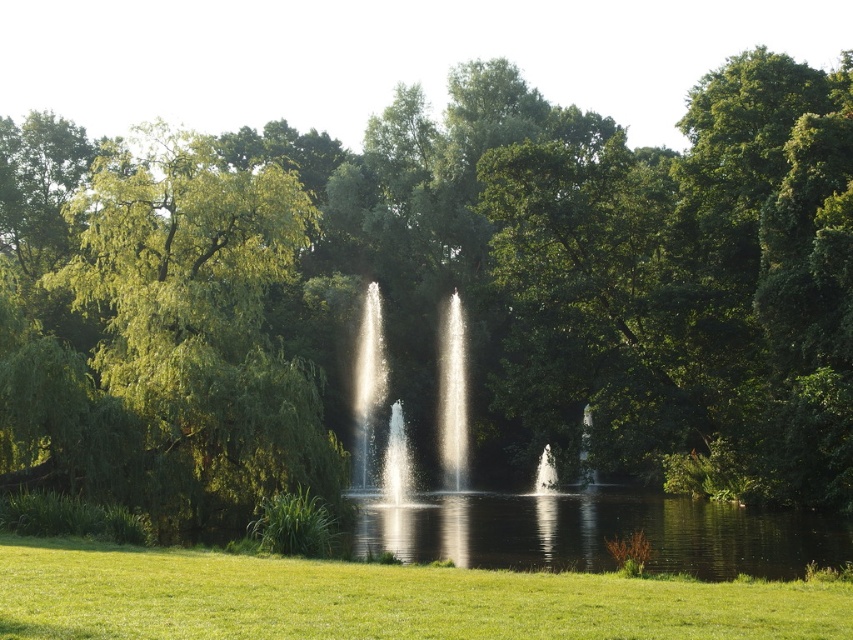
From the picture: You are standing in the park and want to take a photo of the green leafy tree at left and the green grass at lower center. Which object will appear closer to you in the photo?

The green leafy tree at left will appear closer to you in the photo because it is positioned further to the viewer than the green grass at lower center.

You are standing at the center of the park and want to take a photo of the green leafy tree at left. Which direction should you face to ensure the tree is in the frame?

The green leafy tree at left is located at point (195, 326), which means it is positioned to your left side. To include it in your photo, you should face towards the left direction.

You are planning to set up a picnic blanket in the park. The picnic blanket is 2 meters wide. You see the green leafy tree at left and the green grass at lower center. Which area is suitable for placing your picnic blanket without it being under the tree?

The green grass at lower center is suitable for placing the picnic blanket since the green leafy tree at left might be wider than the blanket, so placing it under the tree might not leave enough space. The grass area is more open.